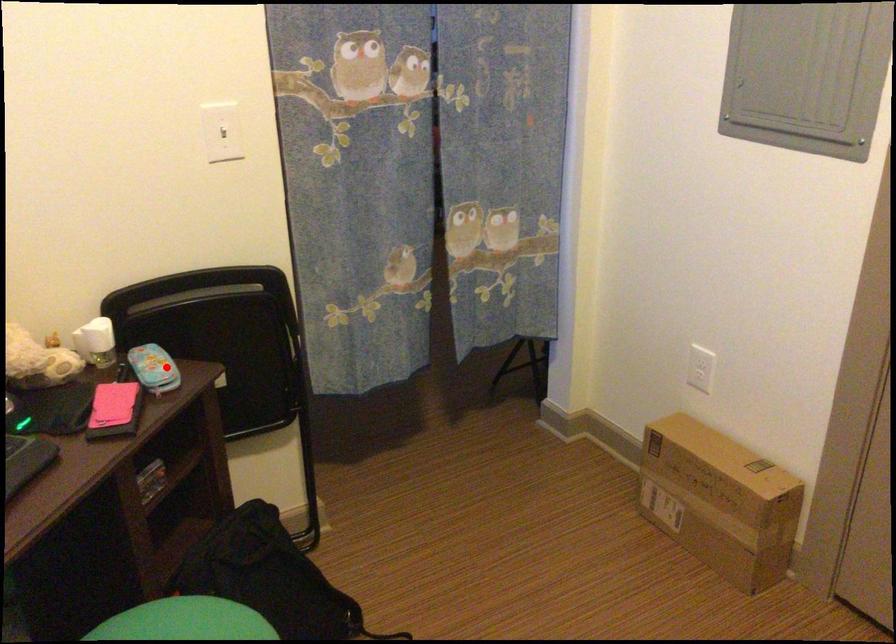
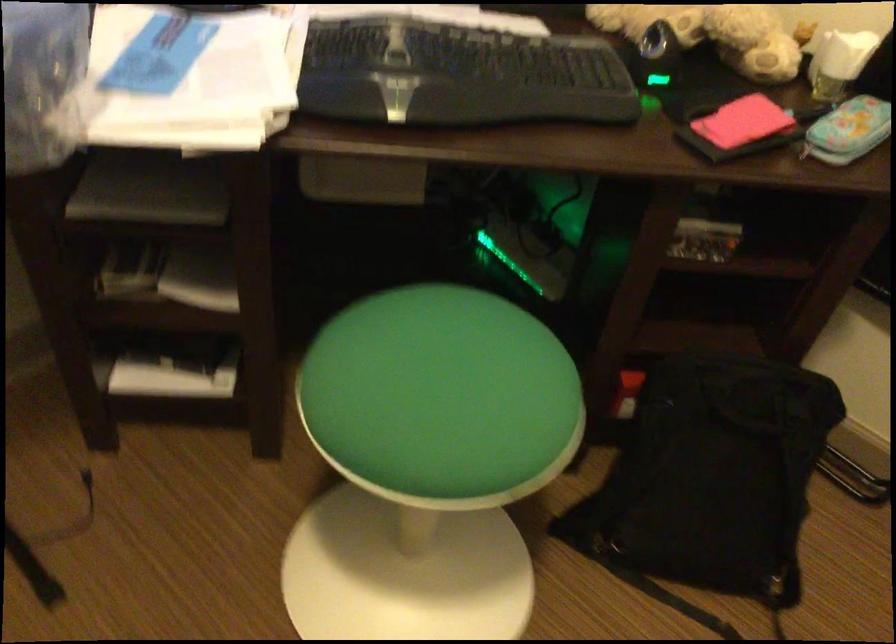
Question: I am providing you with two images of the same scene from different viewpoints. Image1 has a red point marked. In image2, the corresponding 3D location appears at what relative position? Reply with the corresponding letter.

Choices:
 (A) Closer
 (B) Farther

Answer: (A)